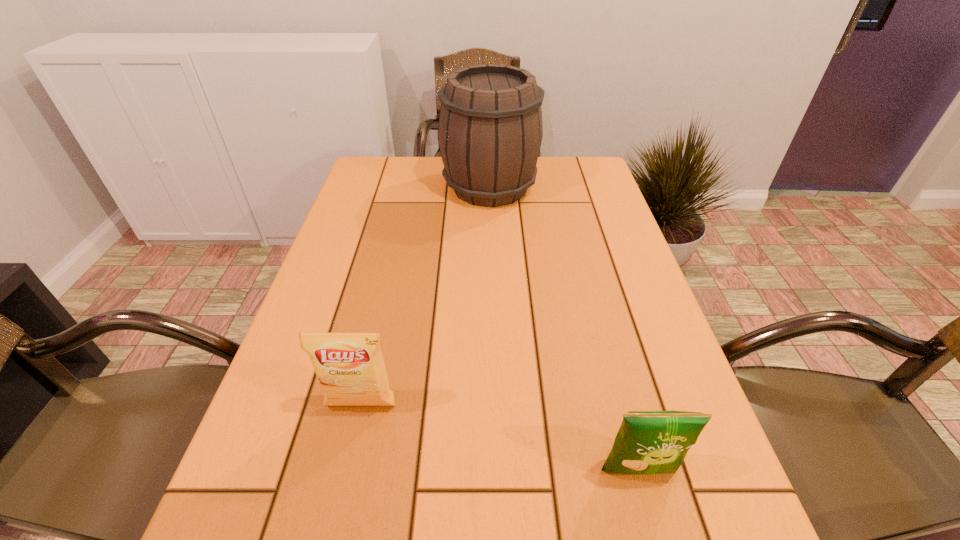
What are the coordinates of `vacant area that lies between the second object from left to right and the leftmost object` in the screenshot? It's located at (425, 296).

Locate an element on the screen. The width and height of the screenshot is (960, 540). free point between the second object from right to left and the shortest object is located at coordinates (564, 329).

Find the location of a particular element. This screenshot has width=960, height=540. empty space that is in between the shortest object and the left crisp (potato chip) is located at coordinates (500, 438).

Where is `vacant space that's between the shortest object and the farthest object`? vacant space that's between the shortest object and the farthest object is located at coordinates (564, 329).

At what (x,y) coordinates should I click in order to perform the action: click on free spot between the shorter crisp (potato chip) and the left crisp (potato chip). Please return your answer as a coordinate pair (x, y). The width and height of the screenshot is (960, 540). Looking at the image, I should click on (500, 438).

Identify the location of object that ranks as the second closest to the farthest object. This screenshot has height=540, width=960. (648, 442).

This screenshot has height=540, width=960. Identify the location of object that is the closest to the nearer crisp (potato chip). (350, 368).